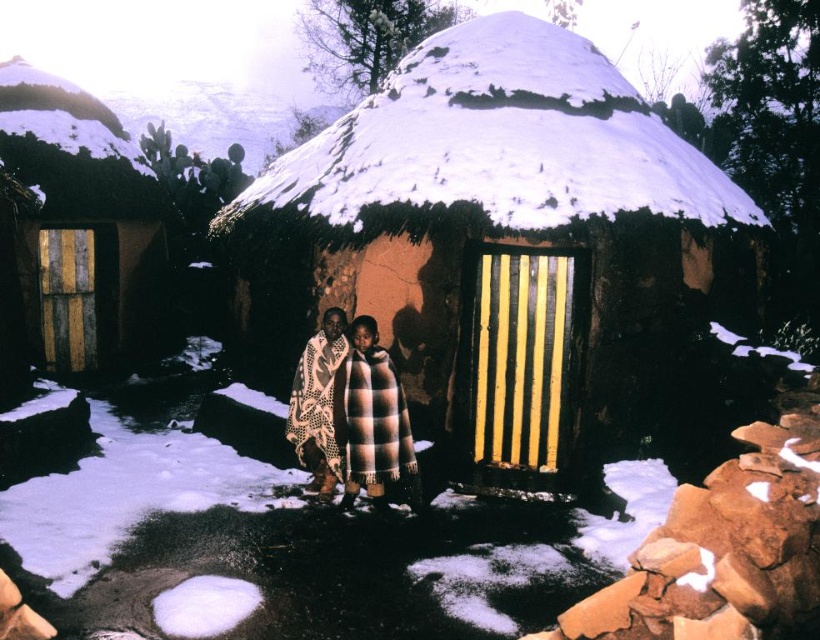
Is brown mud hut at center wider than plaid wool blanket at center?

Yes, brown mud hut at center is wider than plaid wool blanket at center.

Which is below, brown mud hut at center or plaid wool blanket at center?

Positioned lower is plaid wool blanket at center.

Who is more forward, (522, 154) or (306, 452)?

Point (306, 452) is in front.

Identify the location of brown mud hut at center. This screenshot has height=640, width=820. (506, 246).

Is brown checkered blanket at center positioned at the back of plaid fabric blanket at center?

No, it is not.

Is point (348, 406) less distant than point (340, 344)?

Yes, it is in front of point (340, 344).

Where is `brown checkered blanket at center`? This screenshot has width=820, height=640. brown checkered blanket at center is located at coordinates (371, 422).

Does plaid wool blanket at center come in front of brown checkered blanket at center?

No, plaid wool blanket at center is further to the viewer.

Is point (390, 394) positioned after point (412, 467)?

No, (390, 394) is closer to viewer.

Which is behind, point (308, 465) or point (349, 394)?

The point (308, 465) is behind.

Find the location of `plaid wool blanket at center`. plaid wool blanket at center is located at coordinates (351, 413).